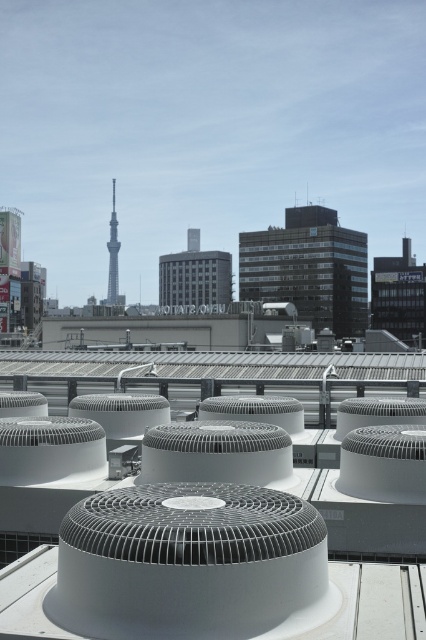
You are a city planner analyzing the rooftop scene. You need to determine which object between the silver metallic tower at center and the gray concrete building at center has a greater width. Based on the scene, what is your conclusion?

The silver metallic tower at center has a larger width than the gray concrete building at center according to the description provided.

You are standing on the rooftop where the air conditioning units are placed. You want to take a photo of the silver metallic tower at center. Given that your camera has a maximum zoom range of 1000 feet, will you need to zoom in to capture the tower in full frame?

The silver metallic tower at center is 911.88 feet away from the camera. Since the camera can zoom up to 1000 feet, you can zoom in to capture the tower in full frame as the distance is within the camera capabilities.

You are standing on the rooftop and want to take a photo of both the silver metallic tower at center and the gray concrete building at center. Which object should you position to your left side to include both in the frame?

You should position the gray concrete building at center to your left side because the silver metallic tower at center is to the left of it, ensuring both are captured in the photo.